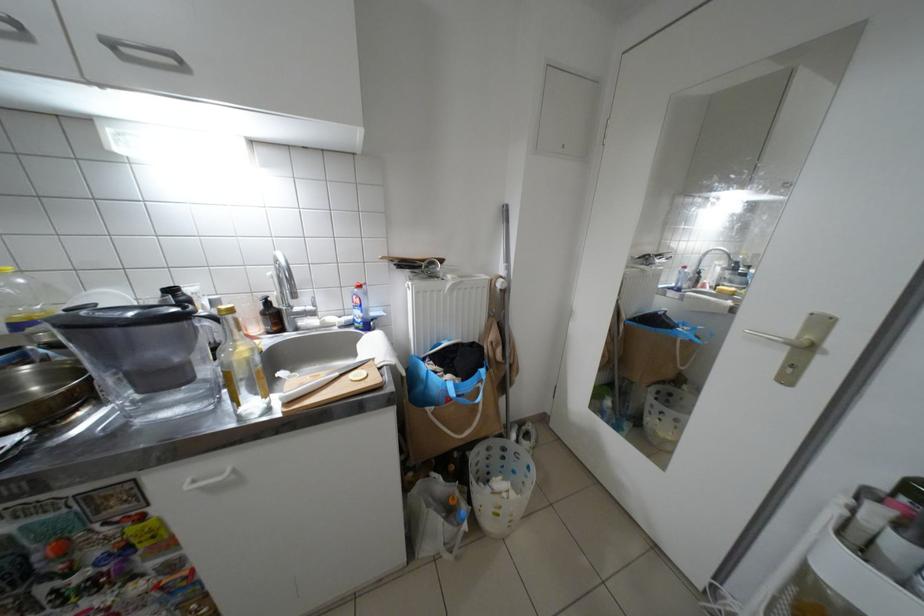
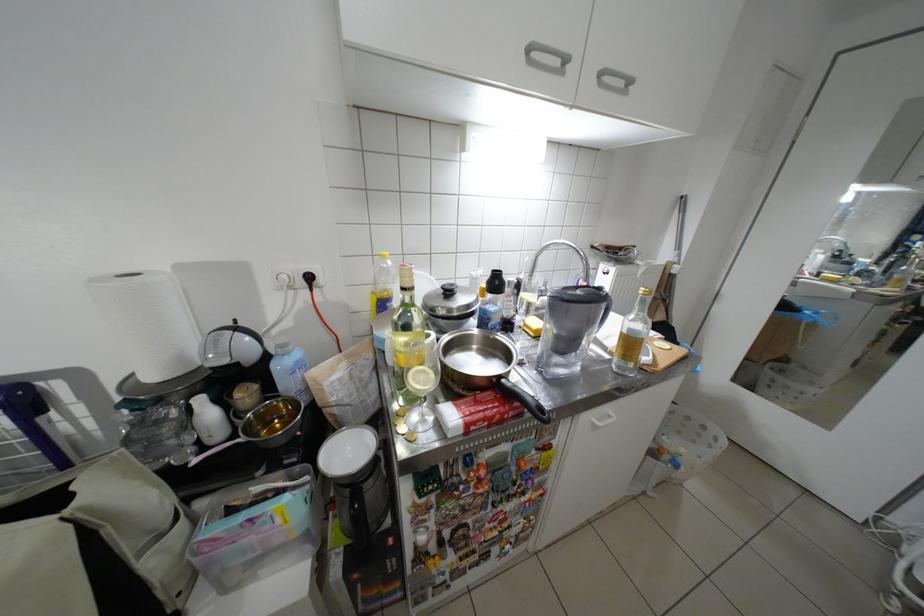
In the second image, find the point that corresponds to (x=33, y=281) in the first image.

(400, 264)